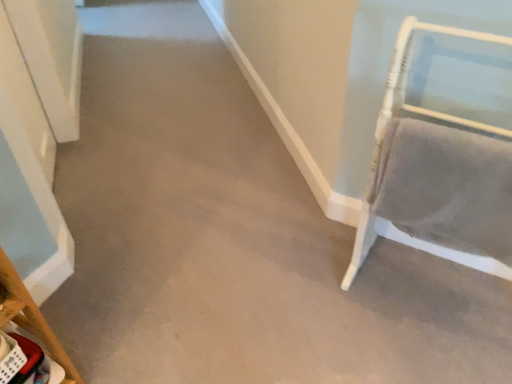
Question: From the image's perspective, is velvet gray chair at right, acting as the first furniture starting from the right, positioned above or below wooden chair at lower left, the second furniture positioned from the right?

Choices:
 (A) below
 (B) above

Answer: (B)

Question: Do you think velvet gray chair at right, acting as the first furniture starting from the right, is within wooden chair at lower left, the 1th furniture in the left-to-right sequence, or outside of it?

Choices:
 (A) inside
 (B) outside

Answer: (B)

Question: Considering the positions of velvet gray chair at right, which is the second furniture in left-to-right order, and wooden chair at lower left, the second furniture positioned from the right, in the image, is velvet gray chair at right, which is the second furniture in left-to-right order, bigger or smaller than wooden chair at lower left, the second furniture positioned from the right,?

Choices:
 (A) small
 (B) big

Answer: (B)

Question: Based on their positions, is wooden chair at lower left, the second furniture positioned from the right, located to the left or right of velvet gray chair at right, acting as the first furniture starting from the right?

Choices:
 (A) left
 (B) right

Answer: (A)

Question: Does point (61, 380) appear closer or farther from the camera than point (408, 129)?

Choices:
 (A) closer
 (B) farther

Answer: (B)

Question: Which is correct: wooden chair at lower left, the second furniture positioned from the right, is inside velvet gray chair at right, acting as the first furniture starting from the right, or outside of it?

Choices:
 (A) outside
 (B) inside

Answer: (A)

Question: From a real-world perspective, is wooden chair at lower left, the second furniture positioned from the right, positioned above or below velvet gray chair at right, acting as the first furniture starting from the right?

Choices:
 (A) above
 (B) below

Answer: (B)